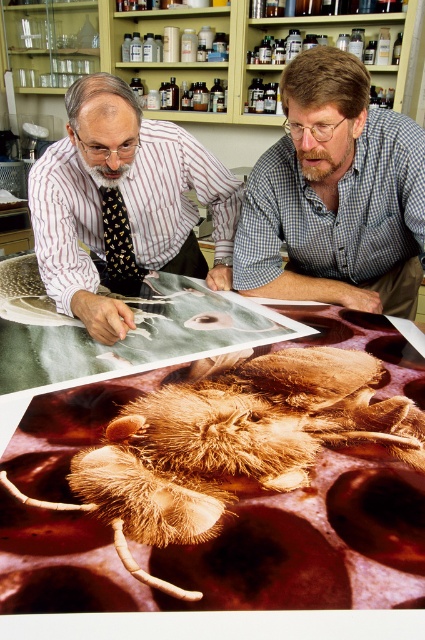
Is brown checkered shirt at upper center bigger than matte black shirt at upper left?

Actually, brown checkered shirt at upper center might be smaller than matte black shirt at upper left.

Is point (348, 108) closer to viewer compared to point (47, 173)?

Yes, point (348, 108) is closer to viewer.

Find the location of `brown checkered shirt at upper center`. brown checkered shirt at upper center is located at coordinates (334, 195).

Is brown paper at center wider than matte black shirt at upper left?

Correct, the width of brown paper at center exceeds that of matte black shirt at upper left.

Is brown paper at center to the left of matte black shirt at upper left from the viewer's perspective?

In fact, brown paper at center is to the right of matte black shirt at upper left.

Describe the element at coordinates (203, 518) in the screenshot. The width and height of the screenshot is (425, 640). I see `brown paper at center` at that location.

You are a GUI agent. You are given a task and a screenshot of the screen. Output one action in this format:
    pyautogui.click(x=<x>, y=<y>)
    Task: Click on the brown paper at center
    This screenshot has width=425, height=640.
    Given the screenshot: What is the action you would take?
    pyautogui.click(x=203, y=518)

Between brown paper at center and brown checkered shirt at upper center, which one has less height?

brown paper at center is shorter.

In order to click on brown paper at center in this screenshot , I will do `click(203, 518)`.

Where is `brown paper at center`? The image size is (425, 640). brown paper at center is located at coordinates (203, 518).